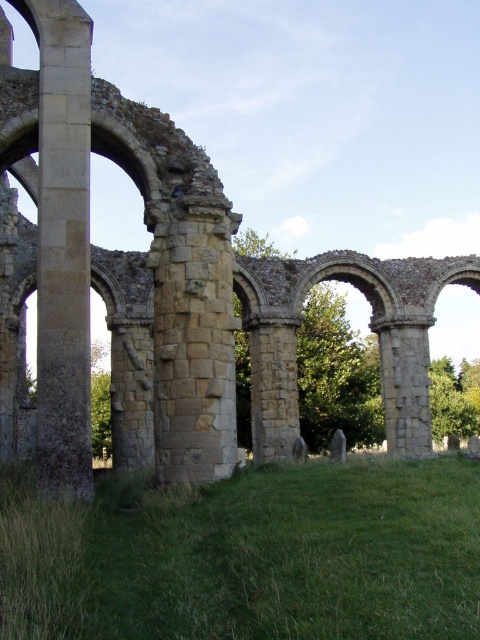
Question: Which of the following is the farthest from the observer?

Choices:
 (A) smooth stone pillar at left
 (B) green grass at lower center

Answer: (A)

Question: Is green grass at lower center positioned at the back of smooth stone pillar at left?

Choices:
 (A) yes
 (B) no

Answer: (B)

Question: Among these objects, which one is farthest from the camera?

Choices:
 (A) smooth stone pillar at left
 (B) green grass at lower center

Answer: (A)

Question: Is green grass at lower center positioned behind smooth stone pillar at left?

Choices:
 (A) no
 (B) yes

Answer: (A)

Question: Is green grass at lower center behind smooth stone pillar at left?

Choices:
 (A) yes
 (B) no

Answer: (B)